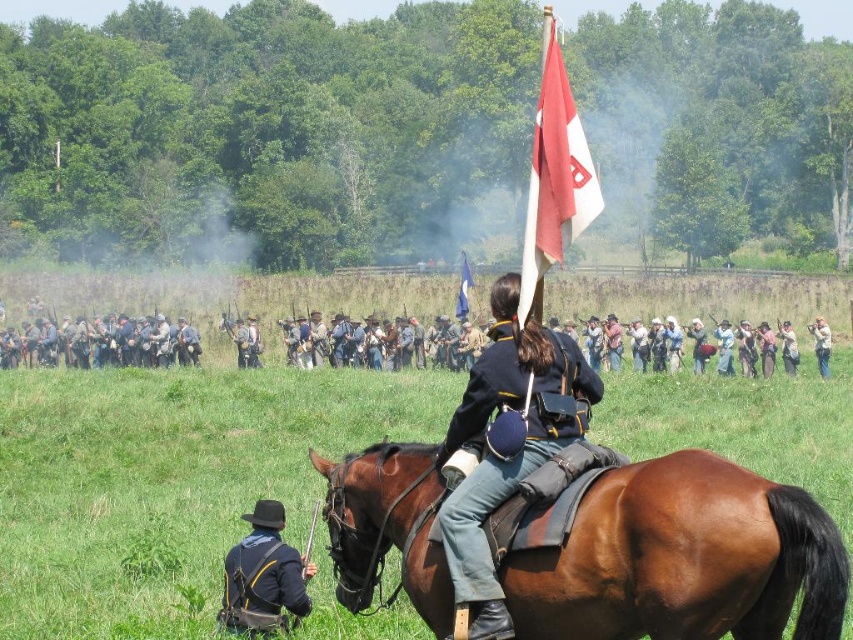
You are a photographer planning to capture a wide shot of the historical reenactment scene. You need to ensure both the green grass at center and the black matte uniform at lower left are visible in the frame. Based on their widths, which object should you prioritize positioning closer to the camera to maintain detail?

The green grass at center has a greater width compared to the black matte uniform at lower left. To maintain detail, prioritize positioning the green grass at center closer to the camera since wider objects may require more focus or framing adjustments to capture their entirety clearly.

You are a photographer positioned at the edge of the field. You need to capture a photo where both the brown leather saddle at center and the blue fabric flag at center are visible. Given their sizes, which object will occupy more space in the photo?

The brown leather saddle at center will occupy more space in the photo since its width surpasses that of the blue fabric flag at center.

You are a photographer at the historical reenactment. You want to capture a photo where the brown leather saddle at center is visible without being blocked by the blue fabric flag at center. Is this possible given their positions?

The brown leather saddle at center is below the blue fabric flag at center, so it is possible to capture a photo where the brown leather saddle at center is visible without being blocked by the blue fabric flag at center by angling the camera slightly downward.